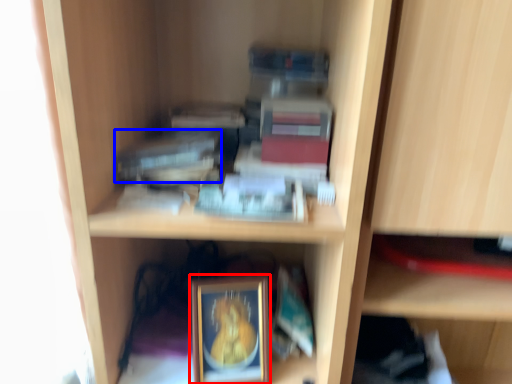
Question: Which of the following is the farthest to the observer, picture frame (highlighted by a red box) or paperback book (highlighted by a blue box)?

Choices:
 (A) picture frame
 (B) paperback book

Answer: (A)